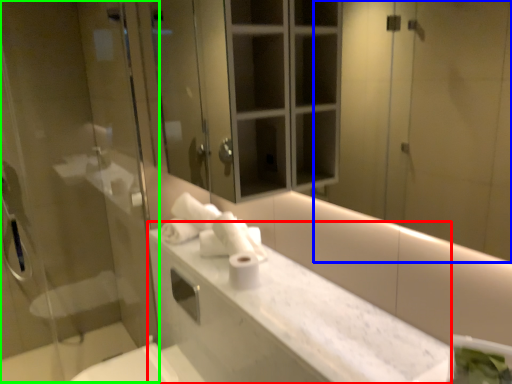
Question: Which object is the closest to the counter top (highlighted by a red box)? Choose among these: mirror (highlighted by a blue box) or screen door (highlighted by a green box).

Choices:
 (A) mirror
 (B) screen door

Answer: (B)